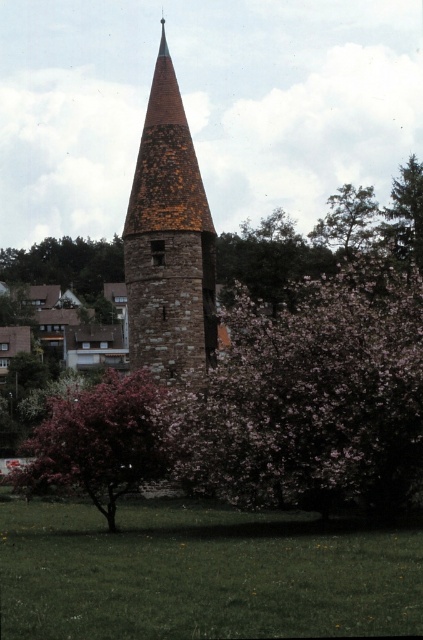
Question: Among these objects, which one is farthest from the camera?

Choices:
 (A) green grass at center
 (B) pink bloom at center
 (C) green leafy tree at upper right

Answer: (C)

Question: Can you confirm if brown stone tower at center is positioned to the right of green leafy tree at upper center?

Choices:
 (A) no
 (B) yes

Answer: (A)

Question: Which of these objects is positioned closest to the brown stone tower at center?

Choices:
 (A) green grass at center
 (B) pink blossoming tree at center
 (C) green leafy tree at upper right

Answer: (B)

Question: Based on their relative distances, which object is farther from the green grass at center?

Choices:
 (A) pink blossoming tree at center
 (B) pink bloom at center
 (C) green leafy tree at upper right
 (D) brown stone tower at center

Answer: (C)

Question: Can you confirm if pink bloom at center is smaller than pink blossoming bush at center?

Choices:
 (A) no
 (B) yes

Answer: (A)

Question: Can you confirm if pink bloom at center is wider than brown stone tower at center?

Choices:
 (A) yes
 (B) no

Answer: (A)